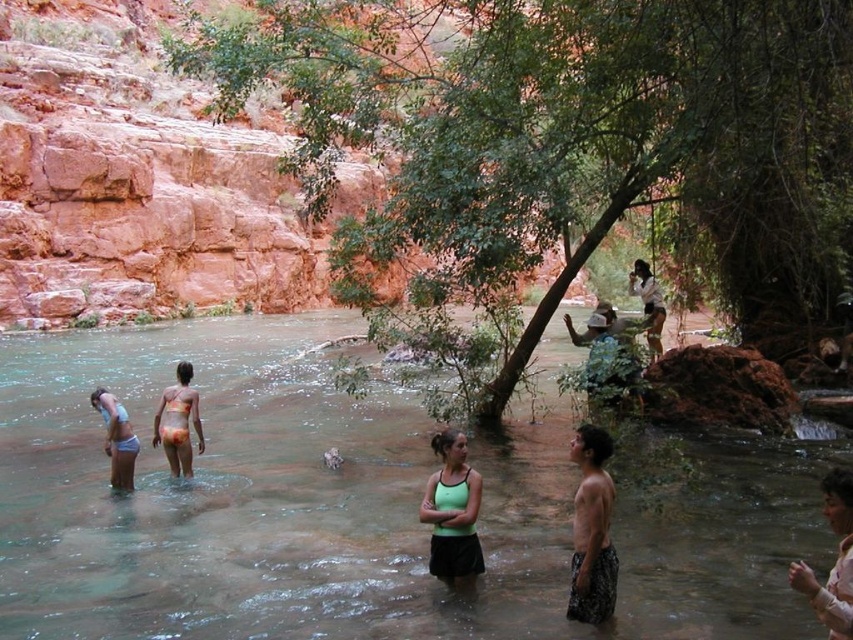
Between printed fabric bikini at center and white cotton shirt at upper center, which one is positioned lower?

Positioned lower is printed fabric bikini at center.

Measure the distance between point [202,448] and camera.

The distance of point [202,448] from camera is 34.69 meters.

Which is behind, point (189, 417) or point (645, 291)?

The point (645, 291) is behind.

Find the location of a particular element. The height and width of the screenshot is (640, 853). printed fabric bikini at center is located at coordinates (178, 422).

Does light blue bikini at lower left appear over white cotton shirt at upper center?

No, light blue bikini at lower left is not above white cotton shirt at upper center.

Consider the image. Which of these two, light blue bikini at lower left or white cotton shirt at upper center, stands taller?

With more height is white cotton shirt at upper center.

Is point (126, 444) farther from camera compared to point (662, 307)?

No, (126, 444) is closer to viewer.

Where is `light blue bikini at lower left`? Image resolution: width=853 pixels, height=640 pixels. light blue bikini at lower left is located at coordinates [115, 438].

Between green matte tank top at center and matte white hat at upper center, which one appears on the right side from the viewer's perspective?

Positioned to the right is matte white hat at upper center.

What do you see at coordinates (451, 512) in the screenshot?
I see `green matte tank top at center` at bounding box center [451, 512].

Find the location of a particular element. The height and width of the screenshot is (640, 853). green matte tank top at center is located at coordinates (451, 512).